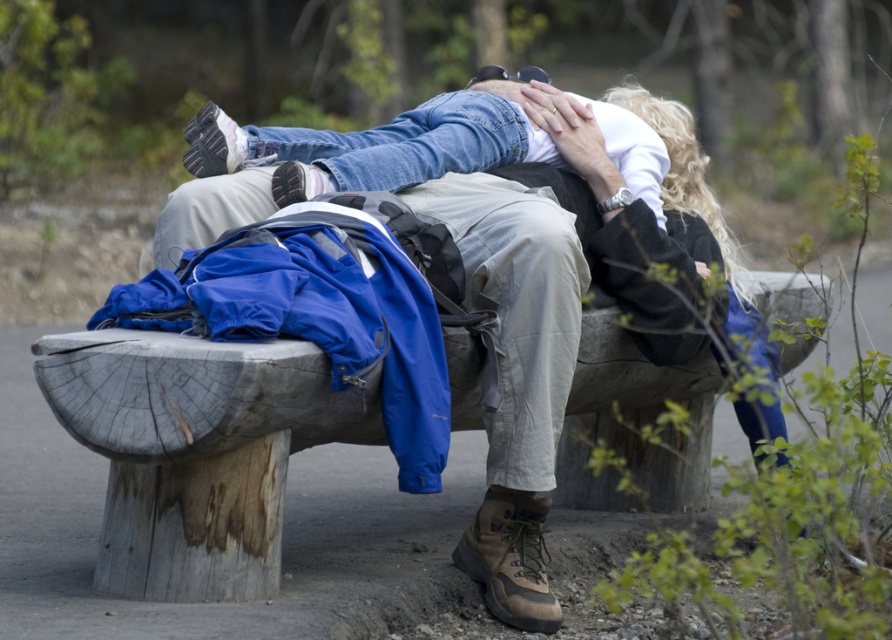
Question: Where is matte blue jacket at center located in relation to weathered wood bench at center in the image?

Choices:
 (A) below
 (B) above

Answer: (B)

Question: Which point is farther to the camera?

Choices:
 (A) matte blue jacket at center
 (B) weathered wood bench at center

Answer: (A)

Question: Is matte blue jacket at center behind weathered wood bench at center?

Choices:
 (A) no
 (B) yes

Answer: (B)

Question: Is matte blue jacket at center smaller than weathered wood bench at center?

Choices:
 (A) yes
 (B) no

Answer: (B)

Question: Which point is farther to the camera?

Choices:
 (A) (354, 161)
 (B) (361, 433)

Answer: (A)